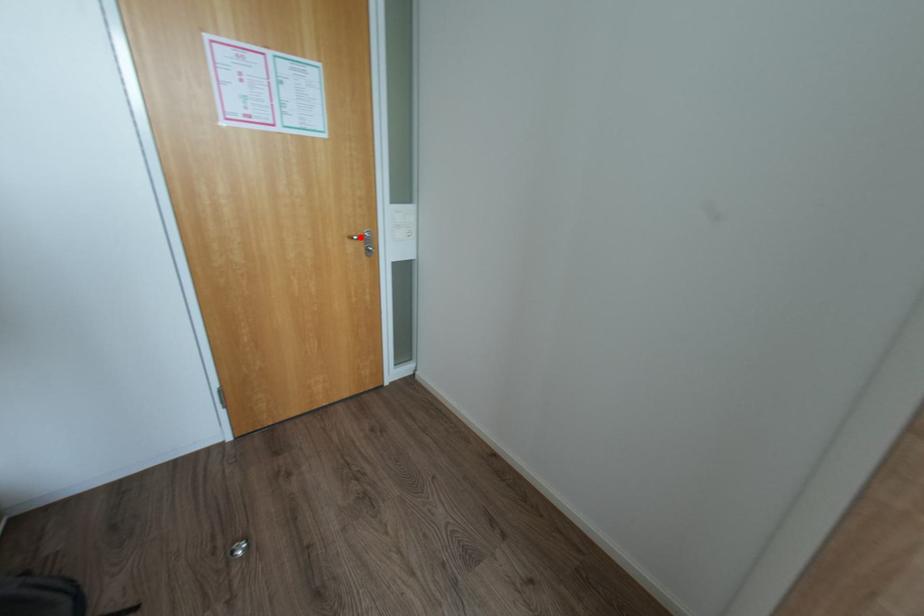
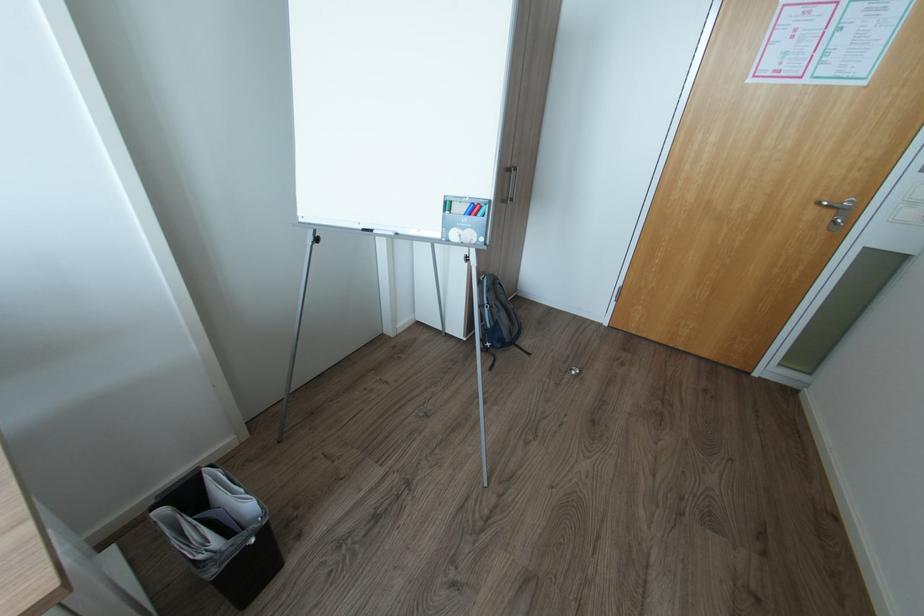
Question: I am providing you with two images of the same scene from different viewpoints. In image1, a red point is highlighted. Considering the same 3D point in image2, which of the following is correct?

Choices:
 (A) It is closer
 (B) It is farther

Answer: (B)